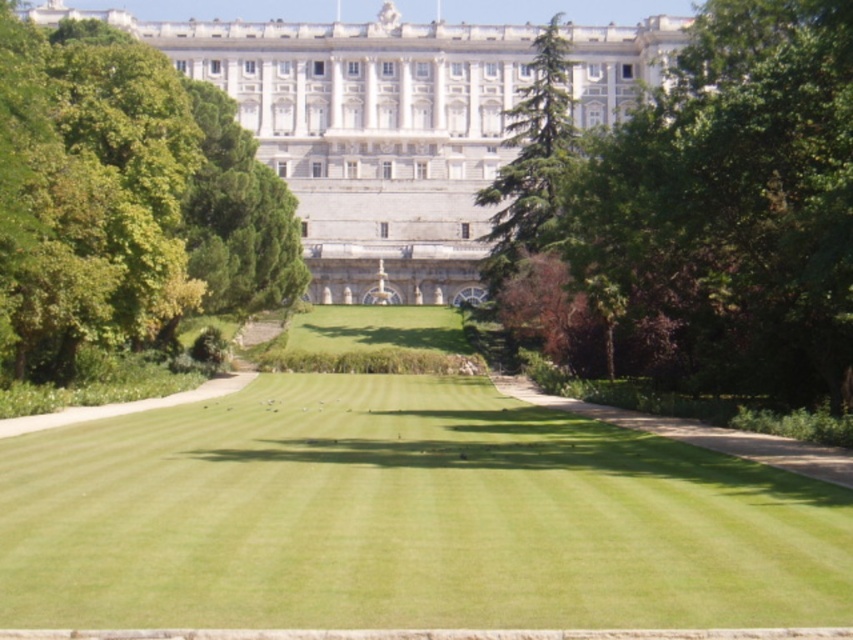
You are standing on the lawn in front of the palace and want to plant a new tree that needs at least 5 meters of space between it and any existing trees. Given the spacing between the green leafy tree at upper center and the green leafy tree at upper left, can you plant the new tree between them?

The green leafy tree at upper center is wider than the green leafy tree at upper left, but the distance between them isn